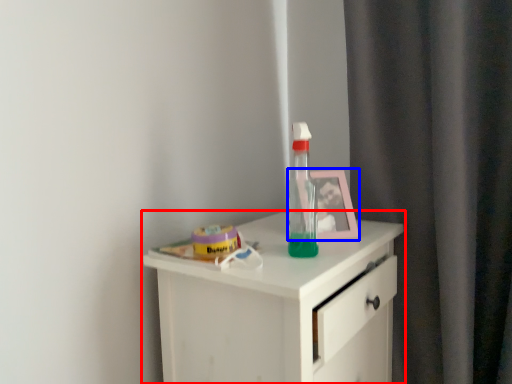
Question: Which object is further to the camera taking this photo, chest of drawers (highlighted by a red box) or picture frame (highlighted by a blue box)?

Choices:
 (A) chest of drawers
 (B) picture frame

Answer: (B)